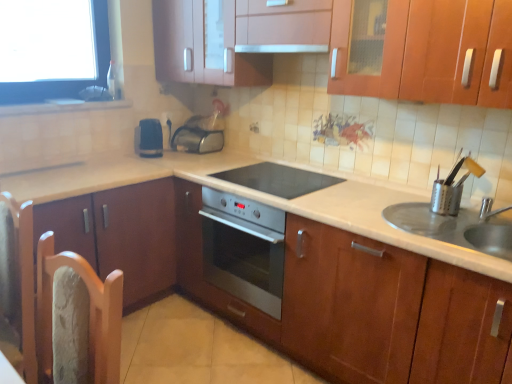
Question: From the image's perspective, is white glossy countertop at center below metallic silver outlet at center?

Choices:
 (A) yes
 (B) no

Answer: (A)

Question: Is white glossy countertop at center shorter than metallic silver outlet at center?

Choices:
 (A) yes
 (B) no

Answer: (B)

Question: Is the depth of white glossy countertop at center greater than that of metallic silver outlet at center?

Choices:
 (A) no
 (B) yes

Answer: (A)

Question: From a real-world perspective, is white glossy countertop at center positioned over metallic silver outlet at center based on gravity?

Choices:
 (A) no
 (B) yes

Answer: (A)

Question: Is white glossy countertop at center far away from metallic silver outlet at center?

Choices:
 (A) no
 (B) yes

Answer: (B)

Question: From a real-world perspective, is black plastic toaster at center, the 1th appliance positioned from the left, above or below black glass cooktop at center?

Choices:
 (A) above
 (B) below

Answer: (A)

Question: Looking at the image, does black plastic toaster at center, the 1th appliance positioned from the left, seem bigger or smaller compared to black glass cooktop at center?

Choices:
 (A) small
 (B) big

Answer: (A)

Question: Considering their positions, is black plastic toaster at center, positioned as the 3th appliance in right-to-left order, located in front of or behind black glass cooktop at center?

Choices:
 (A) behind
 (B) front

Answer: (A)

Question: Would you say black plastic toaster at center, placed as the second appliance when sorted from back to front, is inside or outside black glass cooktop at center?

Choices:
 (A) outside
 (B) inside

Answer: (A)

Question: Based on their sizes in the image, would you say white glossy exhaust hood at upper center is bigger or smaller than metallic silver toaster at center, which is the 3th appliance from bottom to top?

Choices:
 (A) small
 (B) big

Answer: (A)

Question: From their relative heights in the image, would you say white glossy exhaust hood at upper center is taller or shorter than metallic silver toaster at center, acting as the second appliance starting from the left?

Choices:
 (A) short
 (B) tall

Answer: (A)

Question: From a real-world perspective, is white glossy exhaust hood at upper center physically located above or below metallic silver toaster at center, positioned as the first appliance in back-to-front order?

Choices:
 (A) above
 (B) below

Answer: (A)

Question: Is white glossy exhaust hood at upper center inside or outside of metallic silver toaster at center, which is the 3th appliance from bottom to top?

Choices:
 (A) outside
 (B) inside

Answer: (A)

Question: Is black plastic toaster at center, the 1th appliance positioned from the left, spatially inside metallic silver utensil holder at right, the third appliance viewed from the back, or outside of it?

Choices:
 (A) inside
 (B) outside

Answer: (B)

Question: Is point (153, 153) closer or farther from the camera than point (457, 205)?

Choices:
 (A) closer
 (B) farther

Answer: (B)